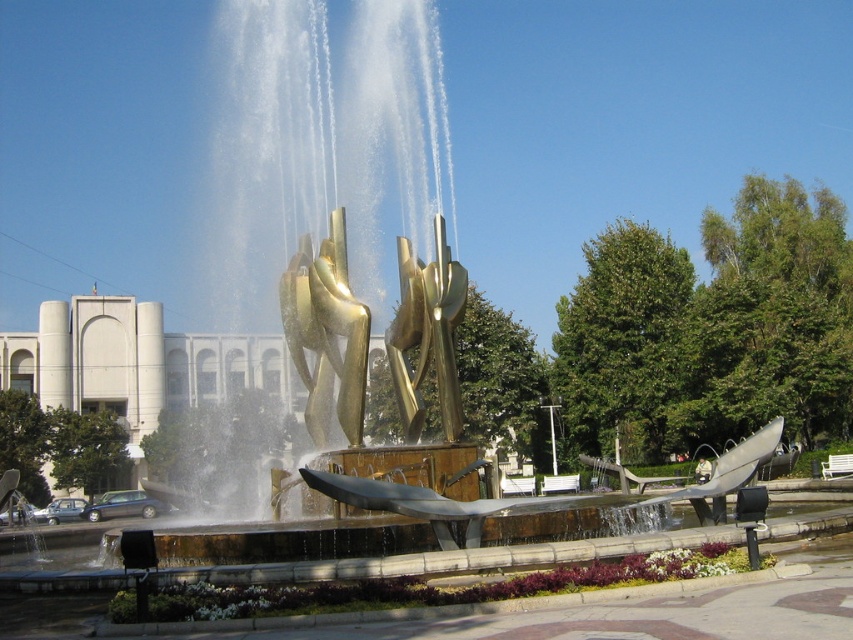
Question: Which point is closer to the camera?

Choices:
 (A) (329, 403)
 (B) (456, 381)

Answer: (B)

Question: From the image, what is the correct spatial relationship of gold metallic water at center in relation to gold polished sculpture at center?

Choices:
 (A) left
 (B) right

Answer: (A)

Question: Which point is closer to the camera?

Choices:
 (A) gold metallic water at center
 (B) gold polished sculpture at center

Answer: (A)

Question: Considering the relative positions of gold metallic water at center and gold polished sculpture at center in the image provided, where is gold metallic water at center located with respect to gold polished sculpture at center?

Choices:
 (A) above
 (B) below

Answer: (A)

Question: Is gold metallic water at center below gold polished sculpture at center?

Choices:
 (A) no
 (B) yes

Answer: (A)

Question: Which of the following is the farthest from the observer?

Choices:
 (A) gold metallic water at center
 (B) gold polished sculpture at center

Answer: (B)